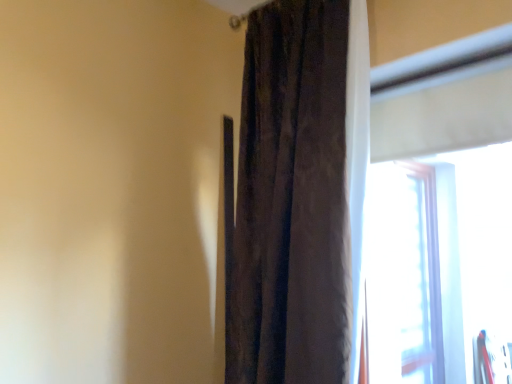
Question: Looking at their shapes, would you say velvet brown curtain at center is wider or thinner than transparent plastic window at right?

Choices:
 (A) wide
 (B) thin

Answer: (A)

Question: Based on their sizes in the image, would you say velvet brown curtain at center is bigger or smaller than transparent plastic window at right?

Choices:
 (A) big
 (B) small

Answer: (A)

Question: Is velvet brown curtain at center inside or outside of transparent plastic window at right?

Choices:
 (A) outside
 (B) inside

Answer: (A)

Question: From the image's perspective, is transparent plastic window at right above or below velvet brown curtain at center?

Choices:
 (A) above
 (B) below

Answer: (B)

Question: Choose the correct answer: Is transparent plastic window at right inside velvet brown curtain at center or outside it?

Choices:
 (A) inside
 (B) outside

Answer: (B)

Question: Does point (496, 132) appear closer or farther from the camera than point (312, 349)?

Choices:
 (A) closer
 (B) farther

Answer: (B)

Question: Looking at their shapes, would you say transparent plastic window at right is wider or thinner than velvet brown curtain at center?

Choices:
 (A) thin
 (B) wide

Answer: (A)